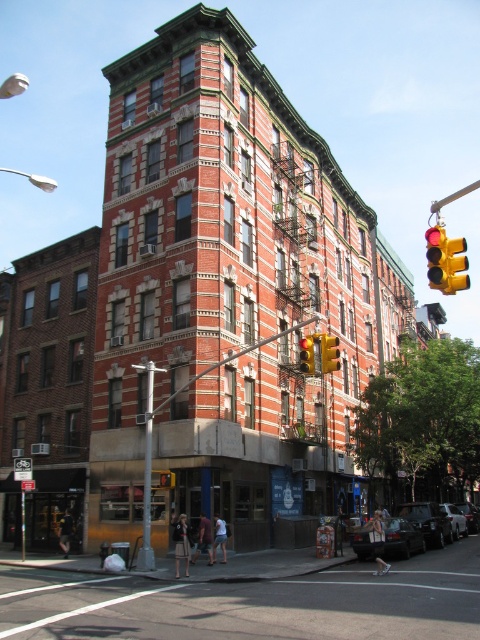
You are standing at the corner of the street looking at the large brick building. There are two points marked on the ground in front of you. The first point is at coordinates point [336,337] and the second is at point [166,481]. Which point is closer to your current position?

Point [336,337] is closer to your current position because it is further to the viewer than point [166,481].

In the scene shown: You are a delivery person trying to secure a package on your bike rack. The yellow metallic traffic light at upper right and the yellow plastic traffic light at upper right are both in your line of sight. Which traffic light is taller?

The yellow metallic traffic light at upper right is taller than the yellow plastic traffic light at upper right according to the description.